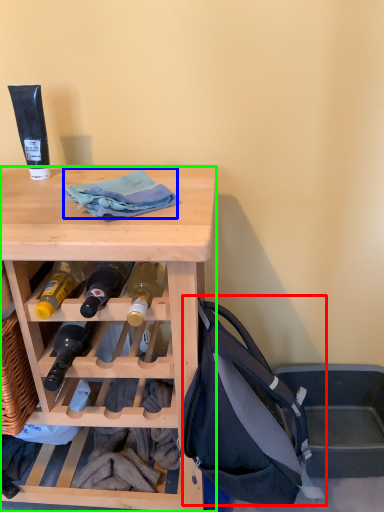
Question: Which is nearer to the handbag (highlighted by a red box)? cloth (highlighted by a blue box) or desk (highlighted by a green box).

Choices:
 (A) cloth
 (B) desk

Answer: (B)